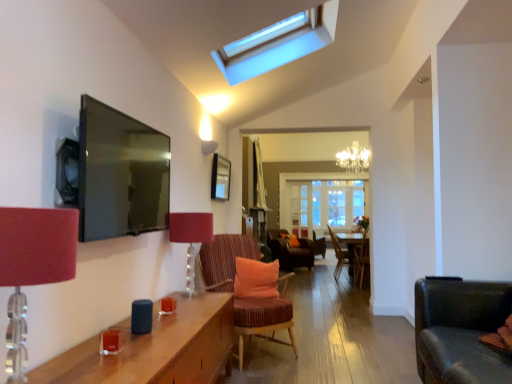
Question: In the image, is transparent glass skylight at upper center on the left side or the right side of wooden side table at center?

Choices:
 (A) left
 (B) right

Answer: (A)

Question: Would you say transparent glass skylight at upper center is inside or outside wooden side table at center?

Choices:
 (A) outside
 (B) inside

Answer: (A)

Question: Estimate the real-world distances between objects in this image. Which object is farther from the striped fabric chair with orange cushion at center, acting as the first chair starting from the front?

Choices:
 (A) transparent glass skylight at upper center
 (B) wooden chair at center, the second chair in the front-to-back sequence
 (C) transparent glass door at center
 (D) wooden chair at center, acting as the 2th chair starting from the back
 (E) velvet orange chair at center, marked as the 4th chair in a front-to-back arrangement

Answer: (C)

Question: Which object is the farthest from the wooden picture frame at center?

Choices:
 (A) orange fabric pillow at center
 (B) wooden chair at center, acting as the 2th chair starting from the back
 (C) striped fabric chair with orange cushion at center, marked as the fourth chair in a back-to-front arrangement
 (D) transparent glass skylight at upper center
 (E) velvet orange chair at center, marked as the 4th chair in a front-to-back arrangement

Answer: (B)